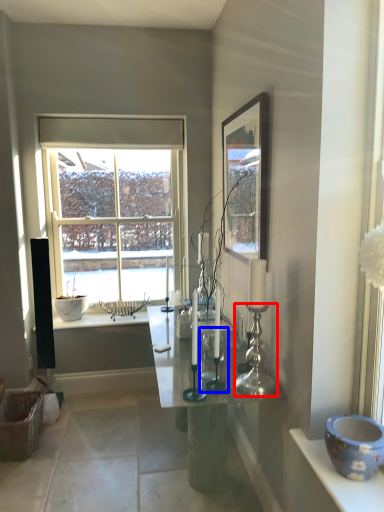
Question: Among these objects, which one is nearest to the camera, candle holder (highlighted by a red box) or candle holder (highlighted by a blue box)?

Choices:
 (A) candle holder
 (B) candle holder

Answer: (A)